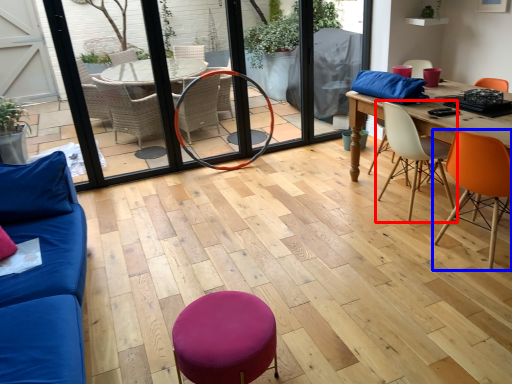
Question: Among these objects, which one is nearest to the camera, chair (highlighted by a red box) or chair (highlighted by a blue box)?

Choices:
 (A) chair
 (B) chair

Answer: (B)